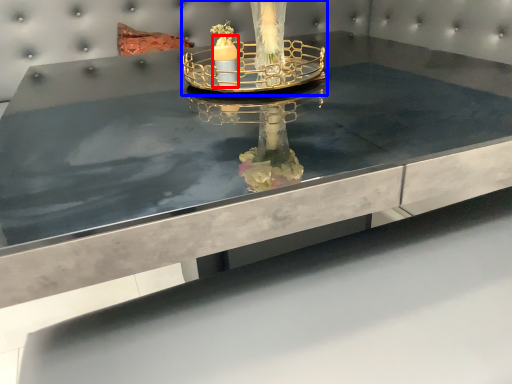
Question: Which of the following is the farthest to the observer, candle (highlighted by a red box) or candle holder (highlighted by a blue box)?

Choices:
 (A) candle
 (B) candle holder

Answer: (A)